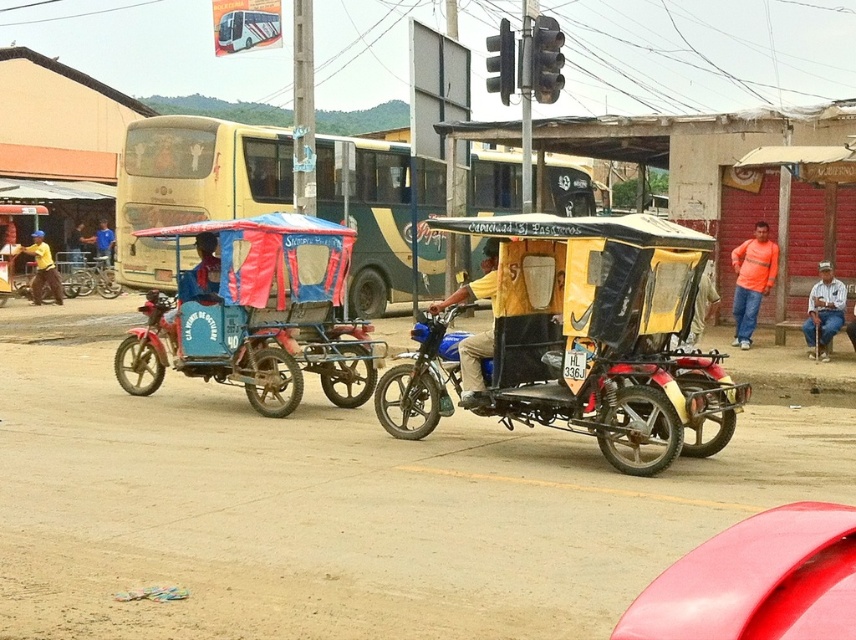
Between yellow matte rickshaw at center and blue fabric umbrella at center, which one appears on the left side from the viewer's perspective?

From the viewer's perspective, blue fabric umbrella at center appears more on the left side.

Is yellow matte rickshaw at center smaller than blue fabric umbrella at center?

No, yellow matte rickshaw at center is not smaller than blue fabric umbrella at center.

Does point (507, 323) come closer to viewer compared to point (90, 237)?

Yes, it is.

You are a GUI agent. You are given a task and a screenshot of the screen. Output one action in this format:
    pyautogui.click(x=<x>, y=<y>)
    Task: Click on the yellow matte rickshaw at center
    The image size is (856, 640).
    Given the screenshot: What is the action you would take?
    pyautogui.click(x=571, y=337)

You are a GUI agent. You are given a task and a screenshot of the screen. Output one action in this format:
    pyautogui.click(x=<x>, y=<y>)
    Task: Click on the white fabric shirt at right
    
    Given the screenshot: What is the action you would take?
    pyautogui.click(x=823, y=310)

Looking at this image, does white fabric shirt at right have a lesser height compared to blue fabric cart at center?

Incorrect, white fabric shirt at right's height does not fall short of blue fabric cart at center's.

Looking at this image, who is more distant from viewer, (834, 324) or (197, 250)?

Positioned behind is point (834, 324).

Identify the location of white fabric shirt at right. (823, 310).

Does orange reflective shirt at right have a lesser height compared to yellow fabric at left?

No, orange reflective shirt at right is not shorter than yellow fabric at left.

Can you confirm if orange reflective shirt at right is positioned above yellow fabric at left?

No.

Is point (765, 289) positioned in front of point (31, 298)?

Yes, point (765, 289) is closer to viewer.

The height and width of the screenshot is (640, 856). I want to click on orange reflective shirt at right, so click(x=752, y=280).